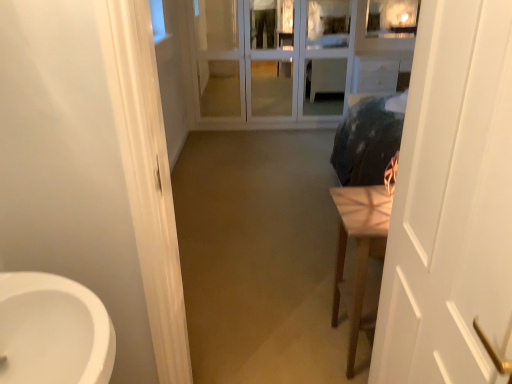
Question: Does white glass screen door at center appear on the left side of light brown wooden table at right?

Choices:
 (A) no
 (B) yes

Answer: (B)

Question: Is white glass screen door at center further to camera compared to light brown wooden table at right?

Choices:
 (A) no
 (B) yes

Answer: (B)

Question: From the image's perspective, does white glass screen door at center appear higher than light brown wooden table at right?

Choices:
 (A) yes
 (B) no

Answer: (A)

Question: Is white glass screen door at center positioned before light brown wooden table at right?

Choices:
 (A) no
 (B) yes

Answer: (A)

Question: Is white glass screen door at center taller than light brown wooden table at right?

Choices:
 (A) no
 (B) yes

Answer: (B)

Question: From a real-world perspective, is light brown wooden table at right positioned above or below white matte door at right?

Choices:
 (A) above
 (B) below

Answer: (B)

Question: Is light brown wooden table at right spatially inside white matte door at right, or outside of it?

Choices:
 (A) outside
 (B) inside

Answer: (A)

Question: From the image's perspective, is light brown wooden table at right above or below white matte door at right?

Choices:
 (A) below
 (B) above

Answer: (A)

Question: Considering the relative positions of light brown wooden table at right and white matte door at right in the image provided, is light brown wooden table at right to the left or to the right of white matte door at right?

Choices:
 (A) right
 (B) left

Answer: (A)

Question: From the image's perspective, is white matte door at right positioned above or below light brown wooden table at right?

Choices:
 (A) above
 (B) below

Answer: (A)

Question: From a real-world perspective, is white matte door at right positioned above or below light brown wooden table at right?

Choices:
 (A) below
 (B) above

Answer: (B)

Question: In terms of width, does white matte door at right look wider or thinner when compared to light brown wooden table at right?

Choices:
 (A) thin
 (B) wide

Answer: (A)

Question: Relative to light brown wooden table at right, is white matte door at right in front or behind?

Choices:
 (A) front
 (B) behind

Answer: (A)

Question: From a real-world perspective, relative to white matte door at right, is white glass screen door at center vertically above or below?

Choices:
 (A) above
 (B) below

Answer: (B)

Question: From the image's perspective, is white glass screen door at center located above or below white matte door at right?

Choices:
 (A) above
 (B) below

Answer: (A)